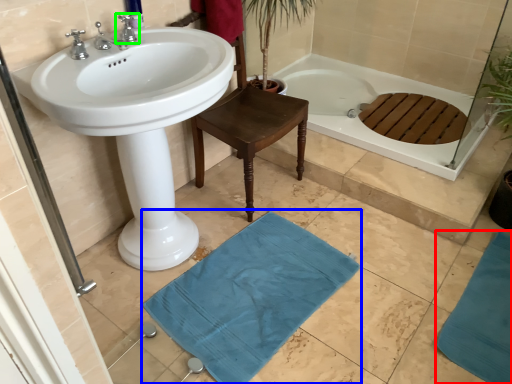
Question: Considering the real-world distances, which object is closest to bath mat (highlighted by a red box)? bath mat (highlighted by a blue box) or tap (highlighted by a green box).

Choices:
 (A) bath mat
 (B) tap

Answer: (A)